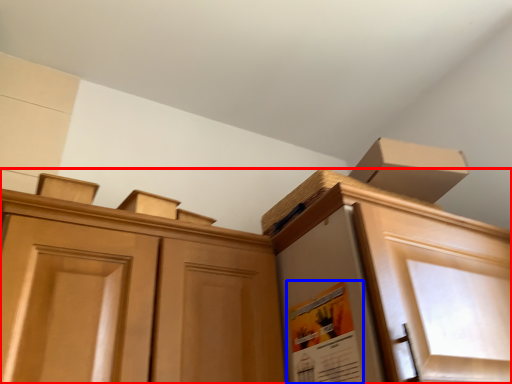
Question: Among these objects, which one is farthest to the camera, cabinetry (highlighted by a red box) or poster (highlighted by a blue box)?

Choices:
 (A) cabinetry
 (B) poster

Answer: (B)